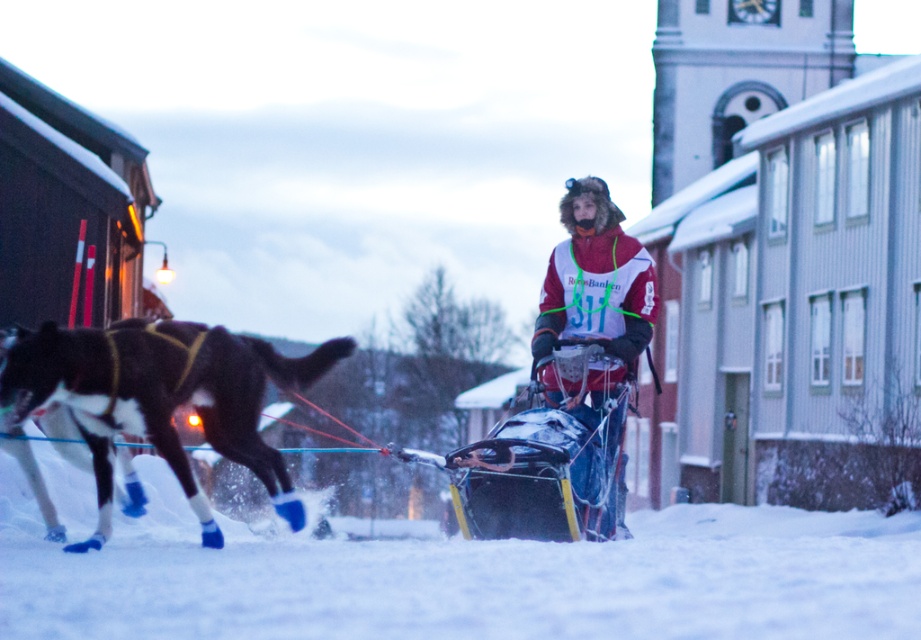
How far apart are white fluffy snow at lower center and red and white jacket at center?

A distance of 3.28 meters exists between white fluffy snow at lower center and red and white jacket at center.

Identify the location of white fluffy snow at lower center. tap(484, 580).

This screenshot has width=921, height=640. In order to click on white fluffy snow at lower center in this screenshot , I will do `click(484, 580)`.

How far apart are white fluffy snow at lower center and black fur dog at left?

3.33 meters

Is white fluffy snow at lower center above black fur dog at left?

Incorrect, white fluffy snow at lower center is not positioned above black fur dog at left.

The height and width of the screenshot is (640, 921). I want to click on white fluffy snow at lower center, so click(484, 580).

Find the location of a particular element. white fluffy snow at lower center is located at coordinates (484, 580).

Can you confirm if black fur dog at left is positioned above red and white jacket at center?

No.

Does black fur dog at left have a lesser width compared to red and white jacket at center?

No, black fur dog at left is not thinner than red and white jacket at center.

Between point (138, 346) and point (572, 275), which one is positioned behind?

The point (572, 275) is behind.

Where is `black fur dog at left`? black fur dog at left is located at coordinates (162, 397).